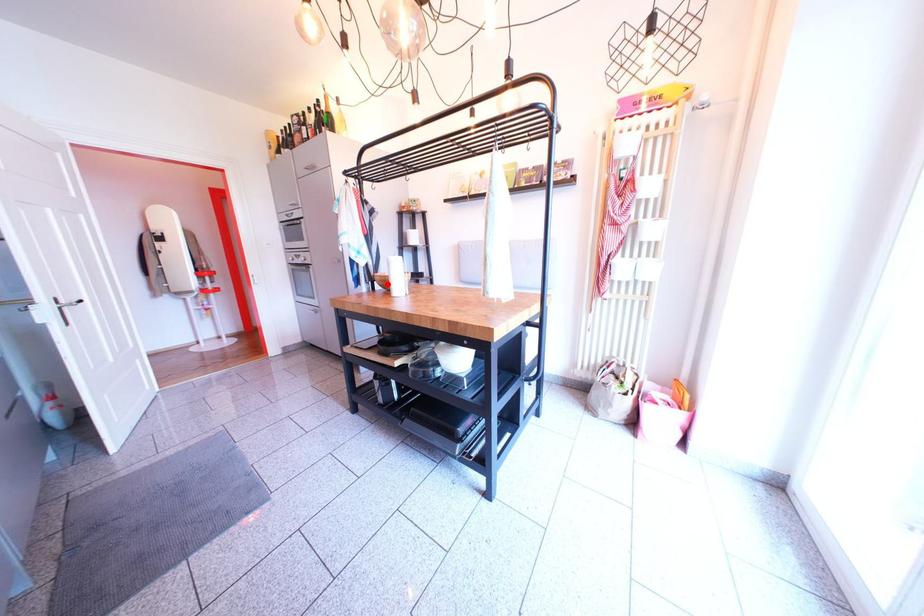
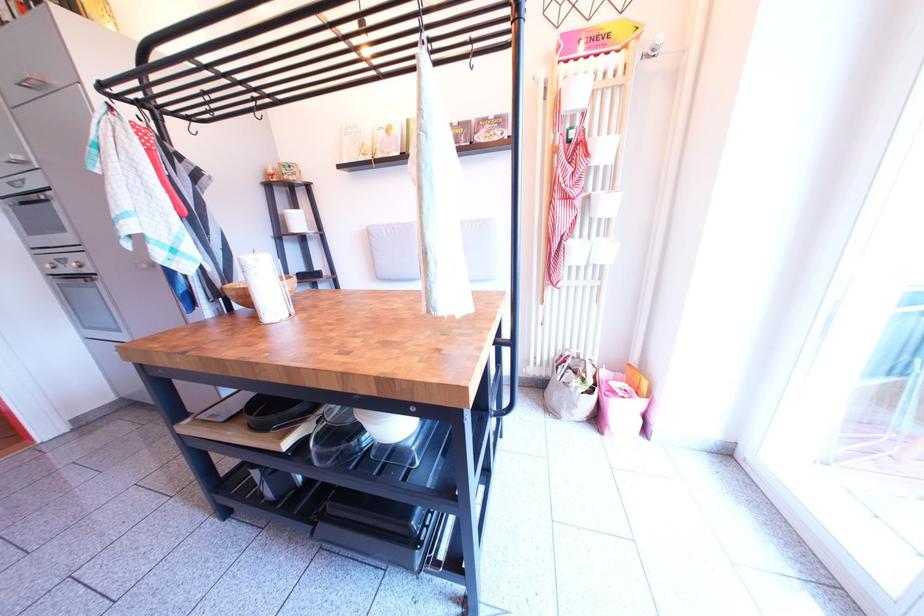
In the second image, find the point that corresponds to the highlighted location in the first image.

(239, 299)